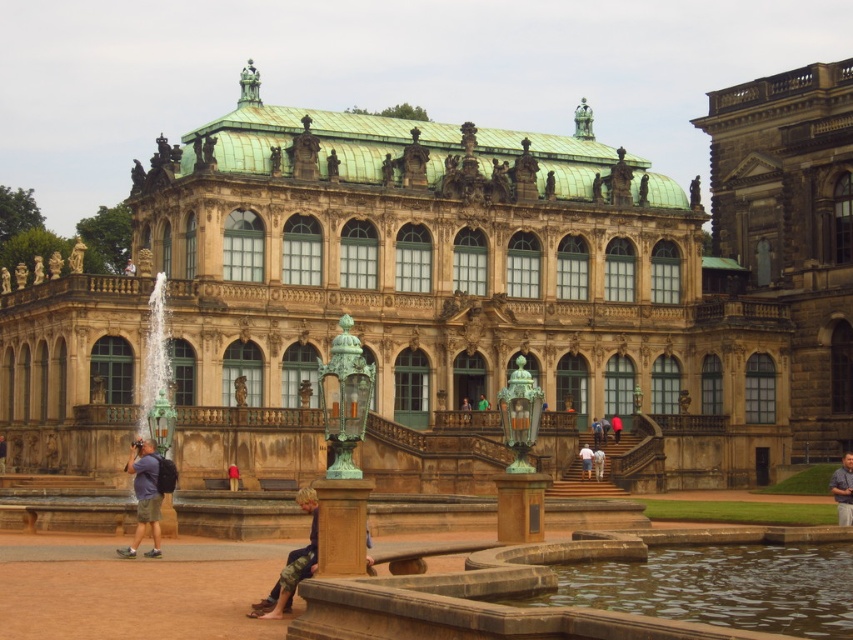
Is green patinated metal at center below red fabric person at center?

Yes, green patinated metal at center is below red fabric person at center.

Does point (531, 496) lie behind point (612, 420)?

No, it is not.

You are a GUI agent. You are given a task and a screenshot of the screen. Output one action in this format:
    pyautogui.click(x=<x>, y=<y>)
    Task: Click on the green patinated metal at center
    Image resolution: width=853 pixels, height=640 pixels.
    Given the screenshot: What is the action you would take?
    pos(520,506)

Find the location of `green patinated metal at center`. green patinated metal at center is located at coordinates (520, 506).

Does white cotton shirt at center come behind pink fabric pants at center?

No, white cotton shirt at center is closer to the viewer.

Is point (589, 452) positioned after point (596, 448)?

No, (589, 452) is in front of (596, 448).

Find the location of a particular element. The height and width of the screenshot is (640, 853). white cotton shirt at center is located at coordinates (585, 461).

Does camouflage pants at lower center have a larger size compared to white fabric shirt at center?

Indeed, camouflage pants at lower center has a larger size compared to white fabric shirt at center.

Based on the photo, measure the distance from camouflage pants at lower center to white fabric shirt at center.

camouflage pants at lower center and white fabric shirt at center are 84.52 feet apart from each other.

Does point (289, 605) lie in front of point (598, 456)?

Yes, point (289, 605) is closer to viewer.

Where is `camouflage pants at lower center`? camouflage pants at lower center is located at coordinates (292, 564).